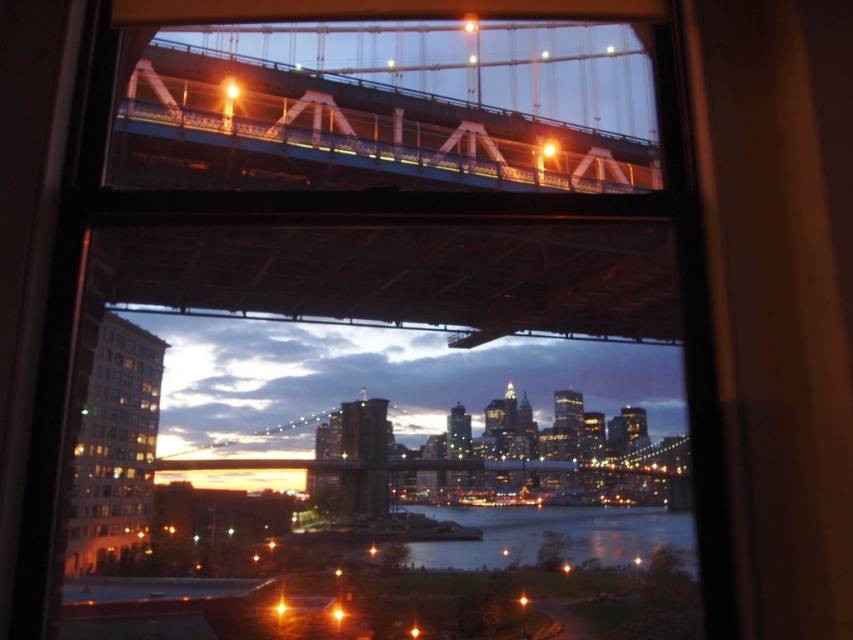
Question: Which point appears farthest from the camera in this image?

Choices:
 (A) (677, 515)
 (B) (148, 456)

Answer: (A)

Question: From the image, what is the correct spatial relationship of matte glass building at lower left in relation to dark blue water at center?

Choices:
 (A) below
 (B) above

Answer: (B)

Question: Considering the relative positions of matte glass building at lower left and dark blue water at center in the image provided, where is matte glass building at lower left located with respect to dark blue water at center?

Choices:
 (A) below
 (B) above

Answer: (B)

Question: Considering the relative positions of matte glass building at lower left and dark blue water at center in the image provided, where is matte glass building at lower left located with respect to dark blue water at center?

Choices:
 (A) above
 (B) below

Answer: (A)